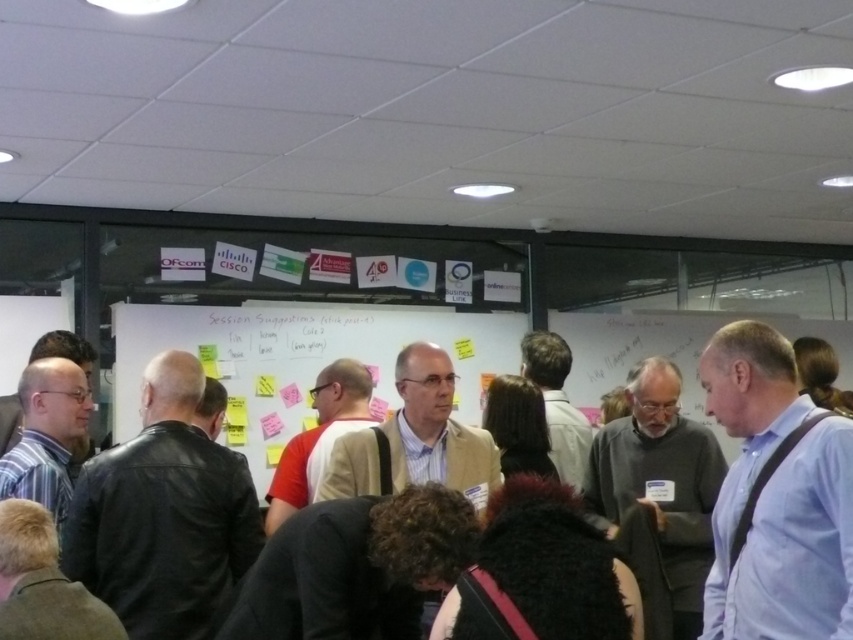
You are organizing a photo shoot in this conference room and need to arrange two participants wearing the blue shirt at center and the dark brown leather jacket at center side by side. Given their clothing thickness, which participant should you place on the left to ensure both can fit comfortably within the frame without overlapping?

The blue shirt at center is thinner than the dark brown leather jacket at center, so placing the participant in the blue shirt at center on the left allows more space for the thicker jacket on the right, ensuring both fit comfortably without overlapping.